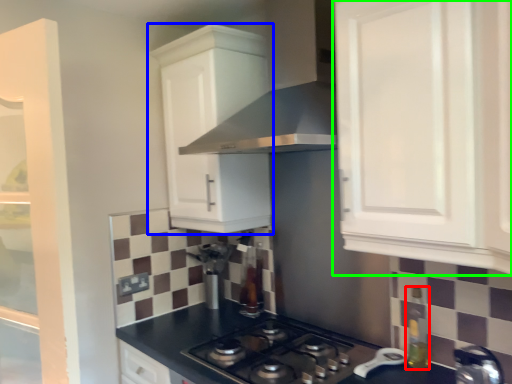
Question: Based on their relative distances, which object is farther from bottle (highlighted by a red box)? Choose from cabinetry (highlighted by a blue box) and cabinetry (highlighted by a green box).

Choices:
 (A) cabinetry
 (B) cabinetry

Answer: (A)